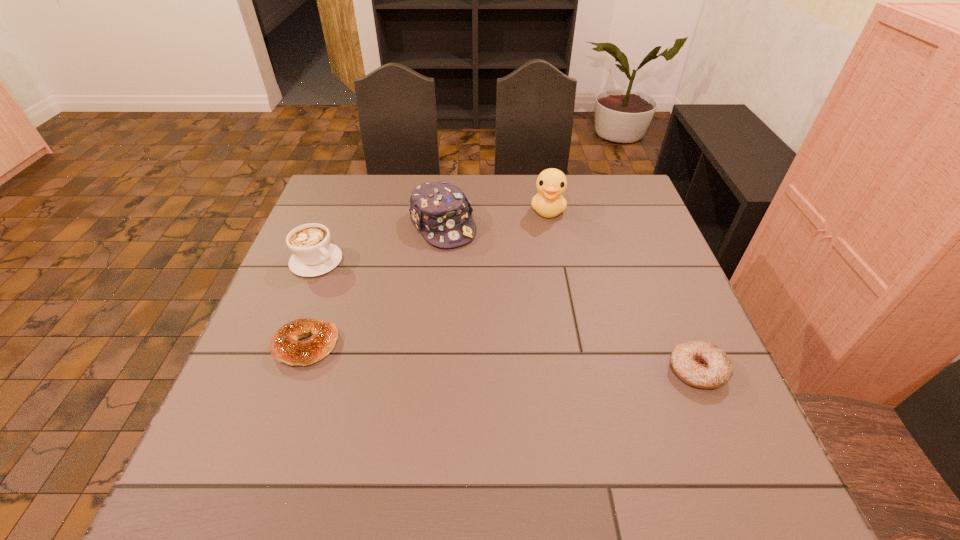
Image resolution: width=960 pixels, height=540 pixels. In order to click on bagel in this screenshot , I will do `click(285, 347)`.

Where is `doughnut`? This screenshot has width=960, height=540. doughnut is located at coordinates (701, 364).

You are a GUI agent. You are given a task and a screenshot of the screen. Output one action in this format:
    pyautogui.click(x=<x>, y=<y>)
    Task: Click on the third shortest object
    Image resolution: width=960 pixels, height=540 pixels.
    Given the screenshot: What is the action you would take?
    pyautogui.click(x=313, y=254)

I want to click on the fourth shortest object, so click(440, 210).

The width and height of the screenshot is (960, 540). Identify the location of the third object from right to left. (440, 210).

Locate an element on the screen. Image resolution: width=960 pixels, height=540 pixels. duck is located at coordinates (551, 183).

I want to click on the fourth object from left to right, so click(x=551, y=183).

At what (x,y) coordinates should I click in order to perform the action: click on free spot located 0.240m on the back of the shortest object. Please return your answer as a coordinate pair (x, y). This screenshot has height=540, width=960. Looking at the image, I should click on (337, 256).

In order to click on free space located on the back of the rightmost object in this screenshot , I will do `click(682, 332)`.

At what (x,y) coordinates should I click in order to perform the action: click on free space located to the right of the cappuccino's handle. Please return your answer as a coordinate pair (x, y). The height and width of the screenshot is (540, 960). Looking at the image, I should click on (448, 344).